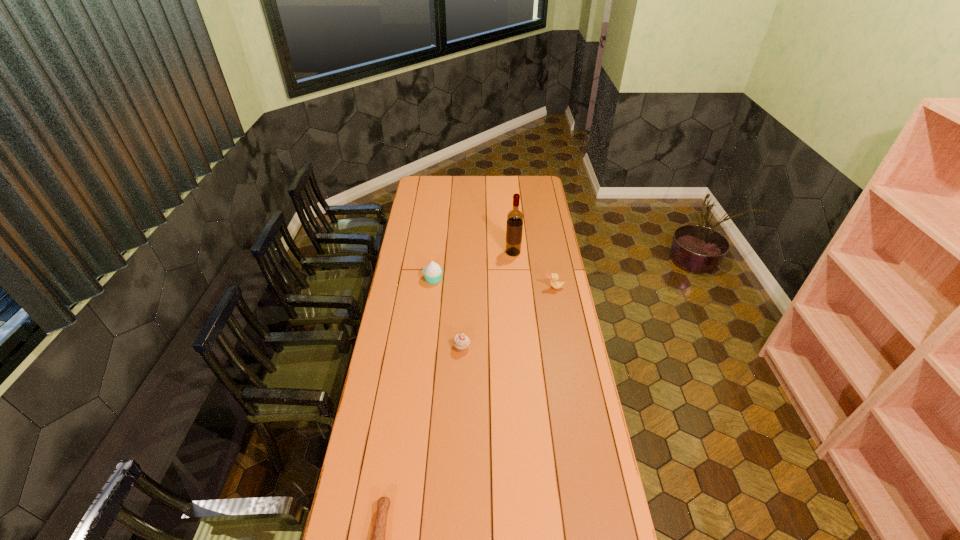
You are a GUI agent. You are given a task and a screenshot of the screen. Output one action in this format:
    pyautogui.click(x=<x>, y=<y>)
    Task: Click on the free space between the farther cupcake and the shorter cupcake
    Image resolution: width=960 pixels, height=540 pixels.
    Given the screenshot: What is the action you would take?
    pyautogui.click(x=447, y=313)

Find the location of a particular element. This screenshot has width=960, height=540. free spot between the nearer cupcake and the fourth shortest object is located at coordinates (447, 313).

Identify the location of vacant area that lies between the second tallest object and the duck. (493, 283).

Locate an element on the screen. free point between the farther cupcake and the shorter cupcake is located at coordinates (447, 313).

The width and height of the screenshot is (960, 540). Identify the location of vacant area that lies between the farther cupcake and the shorter cupcake. (447, 313).

This screenshot has height=540, width=960. Identify the location of the third closest object to the left cupcake. (554, 277).

Locate which object ranks third in proximity to the tallest object. Please provide its 2D coordinates. Your answer should be formatted as a tuple, i.e. [(x, y)], where the tuple contains the x and y coordinates of a point satisfying the conditions above.

[(461, 342)]

Find the location of a particular element. The image size is (960, 540). blank area in the image that satisfies the following two spatial constraints: 1. on the back side of the wine bottle; 2. on the right side of the right cupcake is located at coordinates (466, 252).